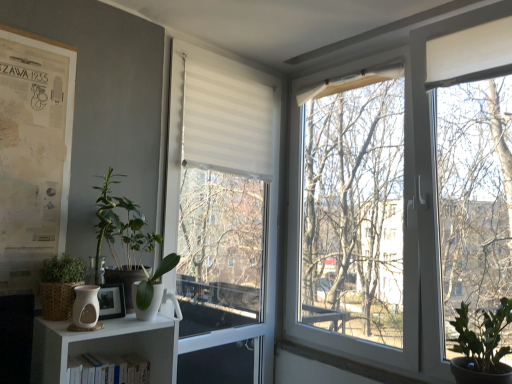
Identify the location of green leafy plant at left, the first vegetation in the left-to-right sequence. (106, 219).

You are a GUI agent. You are given a task and a screenshot of the screen. Output one action in this format:
    pyautogui.click(x=<x>, y=<y>)
    Task: Click on the green matte plant at left, which is counted as the second vegetation, starting from the left
    The width and height of the screenshot is (512, 384).
    Given the screenshot: What is the action you would take?
    pyautogui.click(x=129, y=237)

In order to face green matte plant at lower right, the third vegetation positioned from the left, should I rotate leftwards or rightwards?

A 28.234 degree turn to the right will do.

Describe the element at coordinates (111, 301) in the screenshot. The image size is (512, 384). I see `wooden picture frame at lower left` at that location.

This screenshot has width=512, height=384. What do you see at coordinates (153, 281) in the screenshot?
I see `white glossy pot at lower left` at bounding box center [153, 281].

Identify the location of green leafy plant at left, which is the third vegetation in right-to-left order. (106, 219).

Does point (103, 374) appear closer or farther from the camera than point (462, 306)?

Point (103, 374) is positioned closer to the camera compared to point (462, 306).

From the image's perspective, between white matte bookshelf at lower left and green matte plant at lower right, the third vegetation positioned from the left, which one is located above?

From the image's view, green matte plant at lower right, the third vegetation positioned from the left, is above.

Considering the sizes of objects white matte bookshelf at lower left and green matte plant at lower right, the third vegetation positioned from the left, in the image provided, who is smaller, white matte bookshelf at lower left or green matte plant at lower right, the third vegetation positioned from the left,?

With smaller size is white matte bookshelf at lower left.

Between white matte bookshelf at lower left and green matte plant at lower right, the 1th vegetation in the right-to-left sequence, which one appears on the left side from the viewer's perspective?

white matte bookshelf at lower left is more to the left.

Can you see white matte bookshelf at lower left touching green leafy plant at left, which is the third vegetation in right-to-left order?

No, white matte bookshelf at lower left is not touching green leafy plant at left, which is the third vegetation in right-to-left order.

Is white matte bookshelf at lower left taller than green leafy plant at left, which is the third vegetation in right-to-left order?

No.

From a real-world perspective, is white matte bookshelf at lower left physically below green leafy plant at left, the first vegetation in the left-to-right sequence?

Yes, from a real-world perspective, white matte bookshelf at lower left is beneath green leafy plant at left, the first vegetation in the left-to-right sequence.

Which object is thinner, white matte bookshelf at lower left or green leafy plant at left, which is the third vegetation in right-to-left order?

Thinner between the two is white matte bookshelf at lower left.

Does point (234, 177) lie behind point (75, 361)?

Yes, point (234, 177) is farther from viewer.

Is there a large distance between white matte window at center and white matte bookshelf at lower left?

They are positioned close to each other.

Considering the positions of objects white matte window at center and white matte bookshelf at lower left in the image provided, who is behind, white matte window at center or white matte bookshelf at lower left?

white matte window at center.

From the image's perspective, which is below, white matte window at center or white matte bookshelf at lower left?

From the image's view, white matte bookshelf at lower left is below.

Could you tell me if white matte window at center is turned towards green matte plant at lower right, the 1th vegetation in the right-to-left sequence?

Yes, white matte window at center faces towards green matte plant at lower right, the 1th vegetation in the right-to-left sequence.

Between white matte window at center and green matte plant at lower right, the third vegetation positioned from the left, which one appears on the left side from the viewer's perspective?

From the viewer's perspective, white matte window at center appears more on the left side.

Can you confirm if white matte window at center is wider than green matte plant at lower right, the third vegetation positioned from the left?

Incorrect, the width of white matte window at center does not surpass that of green matte plant at lower right, the third vegetation positioned from the left.

Is white matte window at center outside of green matte plant at lower right, the third vegetation positioned from the left?

Yes.

Which point is more forward, (197, 112) or (3, 210)?

The point (3, 210) is in front.

Considering the sizes of objects white matte window at center and white paperboard poster at left in the image provided, who is wider, white matte window at center or white paperboard poster at left?

white matte window at center is wider.

Can we say white matte window at center lies outside white paperboard poster at left?

Yes, white matte window at center is not within white paperboard poster at left.

Is white matte window at center oriented towards white paperboard poster at left?

No, white matte window at center is not turned towards white paperboard poster at left.

From a real-world perspective, which is physically above, white matte window at center or green matte plant at left, which is counted as the second vegetation, starting from the right?

In real-world perspective, white matte window at center is above.

Between white matte window at center and green matte plant at left, which is counted as the second vegetation, starting from the right, which one has smaller size?

green matte plant at left, which is counted as the second vegetation, starting from the right.

Can you confirm if white matte window at center is positioned to the left of green matte plant at left, which is counted as the second vegetation, starting from the left?

No.

Which object is more forward, white matte window at center or green matte plant at left, which is counted as the second vegetation, starting from the left?

green matte plant at left, which is counted as the second vegetation, starting from the left, is more forward.

Is point (506, 324) more distant than point (64, 74)?

No, it is in front of (64, 74).

Does green matte plant at lower right, the 1th vegetation in the right-to-left sequence, have a lesser width compared to white paperboard poster at left?

In fact, green matte plant at lower right, the 1th vegetation in the right-to-left sequence, might be wider than white paperboard poster at left.

Where is `vegetation that is the 3rd object to the right of the white matte bookshelf at lower left, starting at the anchor`? vegetation that is the 3rd object to the right of the white matte bookshelf at lower left, starting at the anchor is located at coordinates (483, 335).

The image size is (512, 384). What are the coordinates of `the 3rd vegetation above when counting from the white matte bookshelf at lower left (from the image's perspective)` in the screenshot? It's located at (106, 219).

Estimate the real-world distances between objects in this image. Which object is closer to white matte bookshelf at lower left, green matte plant at left, which is counted as the second vegetation, starting from the left, or white paperboard poster at left?

Based on the image, green matte plant at left, which is counted as the second vegetation, starting from the left, appears to be nearer to white matte bookshelf at lower left.

Based on their spatial positions, is white matte bookshelf at lower left or green leafy plant at left, which is the third vegetation in right-to-left order, closer to white paperboard poster at left?

green leafy plant at left, which is the third vegetation in right-to-left order, is positioned closer to the anchor white paperboard poster at left.

Considering their positions, is white paperboard poster at left positioned closer to white matte bookshelf at lower left than green matte plant at left, which is counted as the second vegetation, starting from the left?

green matte plant at left, which is counted as the second vegetation, starting from the left, is closer to white matte bookshelf at lower left.

Looking at the image, which one is located further to wooden picture frame at lower left, matte white vase at lower left or white paperboard poster at left?

white paperboard poster at left.

Based on the photo, looking at the image, which one is located further to wooden picture frame at lower left, green matte plant at lower right, the third vegetation positioned from the left, or matte white vase at lower left?

green matte plant at lower right, the third vegetation positioned from the left.

Based on their spatial positions, is white matte bookshelf at lower left or white matte window at center further from wooden picture frame at lower left?

The object further to wooden picture frame at lower left is white matte window at center.

Looking at the image, which one is located further to white matte window at center, green matte plant at lower right, the 1th vegetation in the right-to-left sequence, or green matte plant at left, which is counted as the second vegetation, starting from the right?

Based on the image, green matte plant at lower right, the 1th vegetation in the right-to-left sequence, appears to be further to white matte window at center.

Looking at the image, which one is located further to green matte plant at lower right, the 1th vegetation in the right-to-left sequence, wooden picture frame at lower left or white glossy pot at lower left?

The object further to green matte plant at lower right, the 1th vegetation in the right-to-left sequence, is wooden picture frame at lower left.

This screenshot has height=384, width=512. In order to click on plant located between green matte plant at left, which is counted as the second vegetation, starting from the right, and green matte plant at lower right, the third vegetation positioned from the left, in the left-right direction in this screenshot , I will do `click(153, 281)`.

You are a GUI agent. You are given a task and a screenshot of the screen. Output one action in this format:
    pyautogui.click(x=<x>, y=<y>)
    Task: Click on the plant that lies between green leafy plant at left, the first vegetation in the left-to-right sequence, and matte white vase at lower left from top to bottom
    The height and width of the screenshot is (384, 512).
    Given the screenshot: What is the action you would take?
    (153, 281)

Identify the location of vegetation between matte white vase at lower left and white glossy pot at lower left. This screenshot has width=512, height=384. (129, 237).

Where is `picture frame between white paperboard poster at left and white matte window at center from left to right`? The height and width of the screenshot is (384, 512). picture frame between white paperboard poster at left and white matte window at center from left to right is located at coordinates (111, 301).